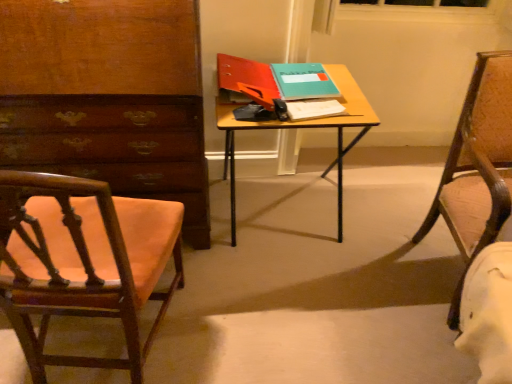
This screenshot has height=384, width=512. Identify the location of free point above wooden desk at center (from a real-world perspective). (284, 82).